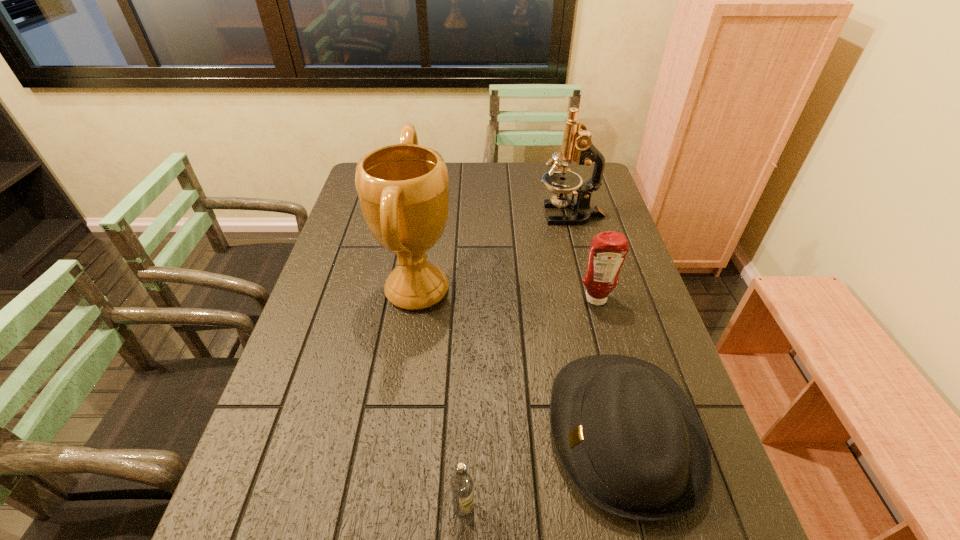
Where is `the closest object relative to the fedora`? the closest object relative to the fedora is located at coordinates tap(462, 483).

The image size is (960, 540). In order to click on free space that satisfies the following two spatial constraints: 1. on the front side of the third shortest object; 2. on the front-facing side of the fedora in this screenshot , I will do `click(632, 433)`.

Locate an element on the screen. vacant point that satisfies the following two spatial constraints: 1. on the front of the leftmost object with the decoration; 2. on the right side of the condiment is located at coordinates (416, 299).

The width and height of the screenshot is (960, 540). I want to click on free location that satisfies the following two spatial constraints: 1. at the eyepiece of the condiment; 2. on the right side of the farthest object, so click(x=593, y=299).

The height and width of the screenshot is (540, 960). I want to click on vacant point that satisfies the following two spatial constraints: 1. on the front-facing side of the fedora; 2. on the label of the second object from left to right, so click(x=642, y=508).

At what (x,y) coordinates should I click in order to perform the action: click on free space that satisfies the following two spatial constraints: 1. at the eyepiece of the third tallest object; 2. on the right side of the microscope. Please return your answer as a coordinate pair (x, y). The image size is (960, 540). Looking at the image, I should click on (593, 299).

Where is `vacant space that satisfies the following two spatial constraints: 1. on the front of the award with the decoration; 2. on the right side of the condiment`? vacant space that satisfies the following two spatial constraints: 1. on the front of the award with the decoration; 2. on the right side of the condiment is located at coordinates (416, 299).

The width and height of the screenshot is (960, 540). In order to click on free location that satisfies the following two spatial constraints: 1. at the eyepiece of the farthest object; 2. on the right side of the condiment in this screenshot , I will do `click(593, 299)`.